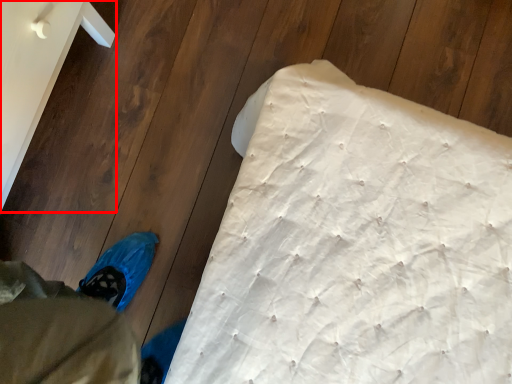
Question: From the image, what is the correct spatial relationship of furniture (annotated by the red box) in relation to mattress?

Choices:
 (A) right
 (B) left

Answer: (B)